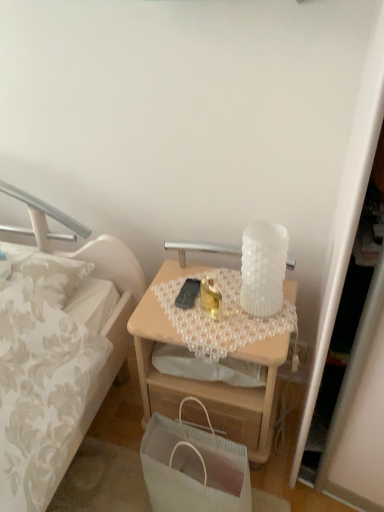
You are a GUI agent. You are given a task and a screenshot of the screen. Output one action in this format:
    pyautogui.click(x=<x>, y=<y>)
    Task: Click on the vacant area on the back side of black matte mobile phone at center
    
    Given the screenshot: What is the action you would take?
    pyautogui.click(x=188, y=274)